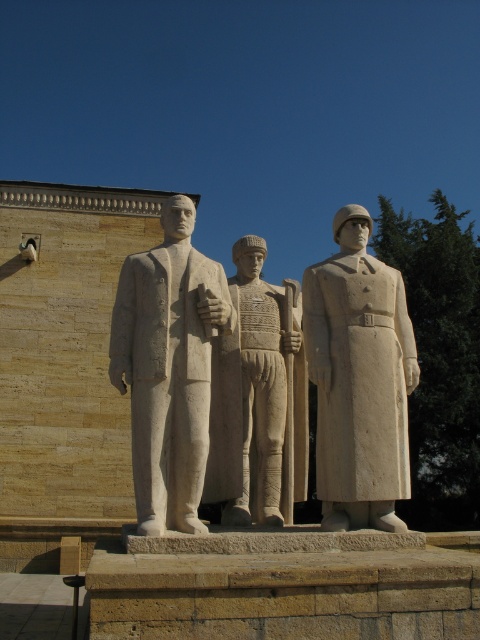
Can you confirm if white stone statue at center is smaller than white stone figure at center?

Actually, white stone statue at center might be larger than white stone figure at center.

Is point (159, 317) closer to camera compared to point (249, 372)?

That is True.

Does point (181, 276) lie in front of point (302, 355)?

Yes.

At what (x,y) coordinates should I click in order to perform the action: click on white stone statue at center. Please return your answer as a coordinate pair (x, y). The width and height of the screenshot is (480, 640). Looking at the image, I should click on (168, 368).

The width and height of the screenshot is (480, 640). What do you see at coordinates (359, 380) in the screenshot?
I see `white stone soldier at center` at bounding box center [359, 380].

Between white stone soldier at center and white stone figure at center, which one appears on the right side from the viewer's perspective?

Positioned to the right is white stone soldier at center.

This screenshot has height=640, width=480. In order to click on white stone soldier at center in this screenshot , I will do `click(359, 380)`.

Find the location of a particular element. This screenshot has height=640, width=480. white stone soldier at center is located at coordinates (359, 380).

Which is more to the left, white stone soldier at center or white stone statue at center?

Positioned to the left is white stone statue at center.

Measure the distance from white stone soldier at center to white stone statue at center.

white stone soldier at center is 11.56 feet from white stone statue at center.

Between point (355, 362) and point (189, 221), which one is positioned behind?

Point (189, 221)

Image resolution: width=480 pixels, height=640 pixels. Find the location of `white stone soldier at center`. white stone soldier at center is located at coordinates (359, 380).